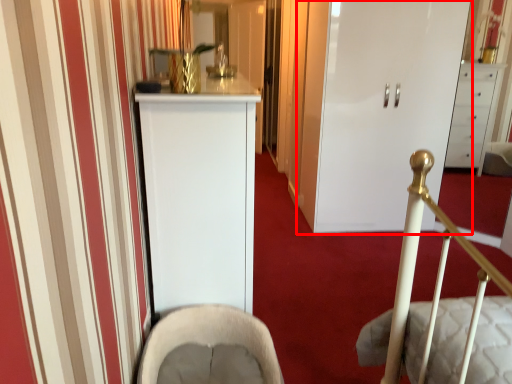
Question: From the image's perspective, considering the relative positions of door (annotated by the red box) and rocking chair in the image provided, where is door (annotated by the red box) located with respect to the staircase?

Choices:
 (A) below
 (B) above

Answer: (B)